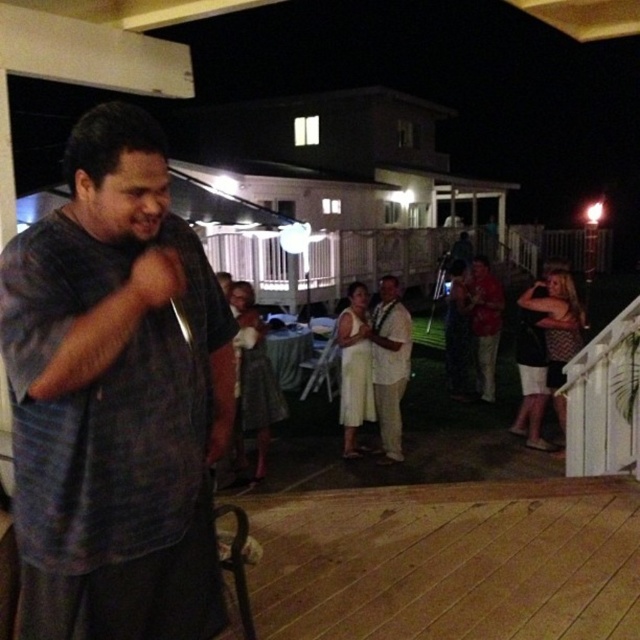
Is point (244, 312) more distant than point (404, 349)?

That is False.

Does white lace dress at center appear under white cotton shirt at center?

Correct, white lace dress at center is located below white cotton shirt at center.

The height and width of the screenshot is (640, 640). Find the location of `white lace dress at center`. white lace dress at center is located at coordinates (252, 384).

Locate an element on the screen. white lace dress at center is located at coordinates pos(252,384).

Does patterned fabric dress at right have a smaller size compared to white satin dress at center?

Incorrect, patterned fabric dress at right is not smaller in size than white satin dress at center.

Is point (522, 356) positioned after point (368, 346)?

Yes, point (522, 356) is behind point (368, 346).

Between point (522, 424) and point (346, 307), which one is positioned behind?

Positioned behind is point (346, 307).

Where is `patterned fabric dress at right`? The image size is (640, 640). patterned fabric dress at right is located at coordinates (545, 346).

Which is in front, point (19, 387) or point (564, 305)?

Point (19, 387)

What do you see at coordinates (115, 397) in the screenshot? The height and width of the screenshot is (640, 640). I see `dark blue shirt at center` at bounding box center [115, 397].

At what (x,y) coordinates should I click in order to perform the action: click on dark blue shirt at center. Please return your answer as a coordinate pair (x, y). Looking at the image, I should click on (115, 397).